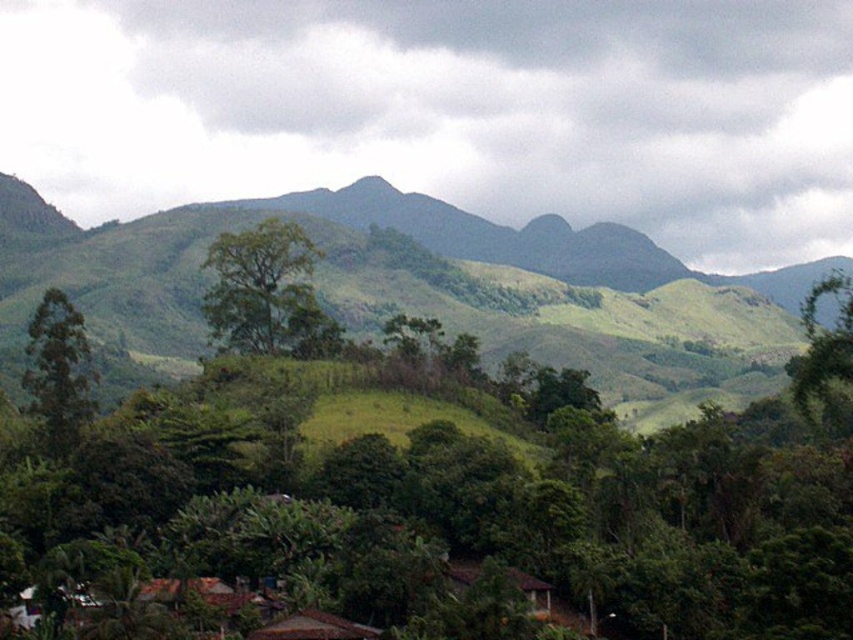
What is the 2D coordinate of the green leafy tree at left in the image?

The green leafy tree at left is located at the 2D coordinate point of [59,371].

You are planning to set up a picnic area in the scene described. You have a large picnic blanket that needs space. Which object from the scene would provide a more suitable location for placing the blanket, the green grassy hill at center or the green leafy tree at right?

The green grassy hill at center is wider than the green leafy tree at right, so it would provide a more suitable location for placing the large picnic blanket.

You are planning to build a hiking trail between the green grassy hill at center and the green leafy tree at right. What is the minimum length of the trail required to connect them directly?

The minimum length of the trail required to connect the green grassy hill at center and the green leafy tree at right directly is 152.68 meters.